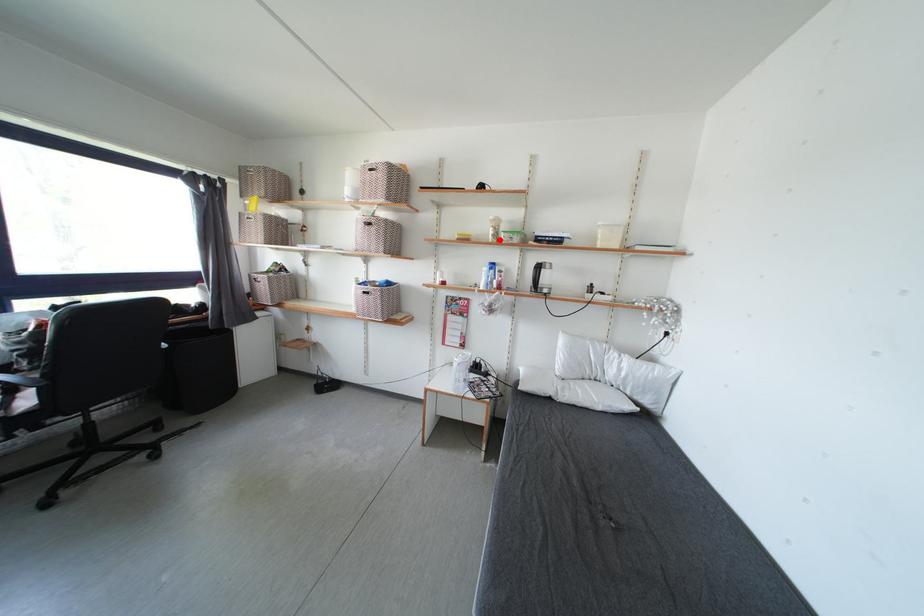
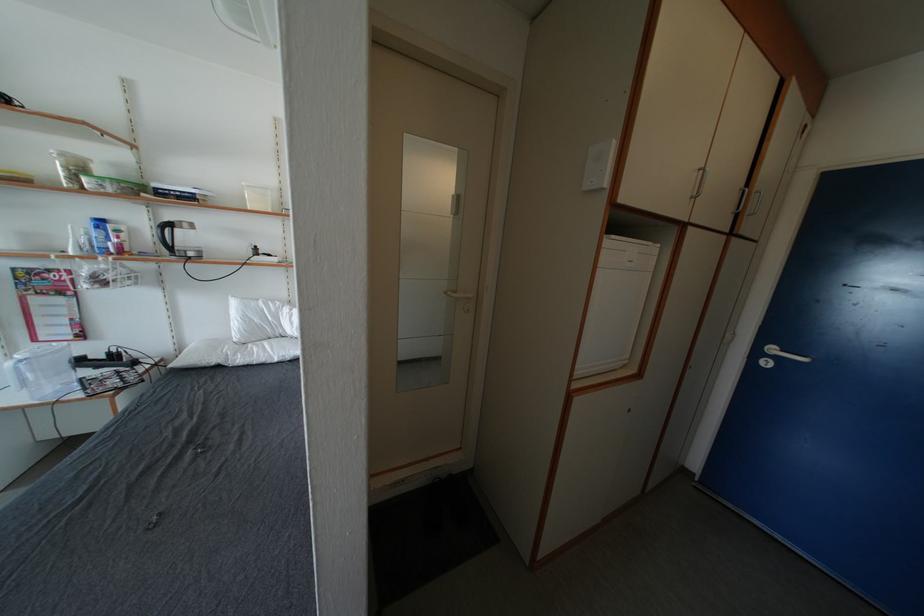
Question: I am providing you with two images of the same scene from different viewpoints. In image1, a red point is highlighted. Considering the same 3D point in image2, which of the following is correct?

Choices:
 (A) It is closer
 (B) It is farther

Answer: (B)